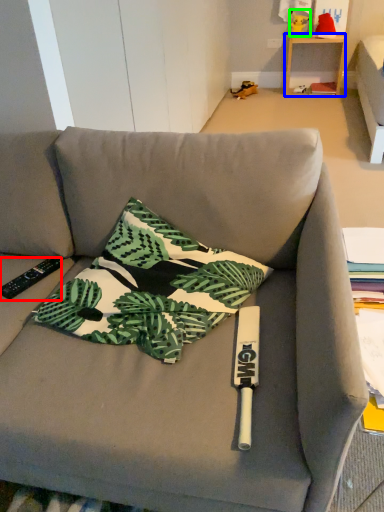
Question: Which object is positioned closest to remote control (highlighted by a red box)? Select from table (highlighted by a blue box) and toy (highlighted by a green box).

Choices:
 (A) table
 (B) toy

Answer: (A)